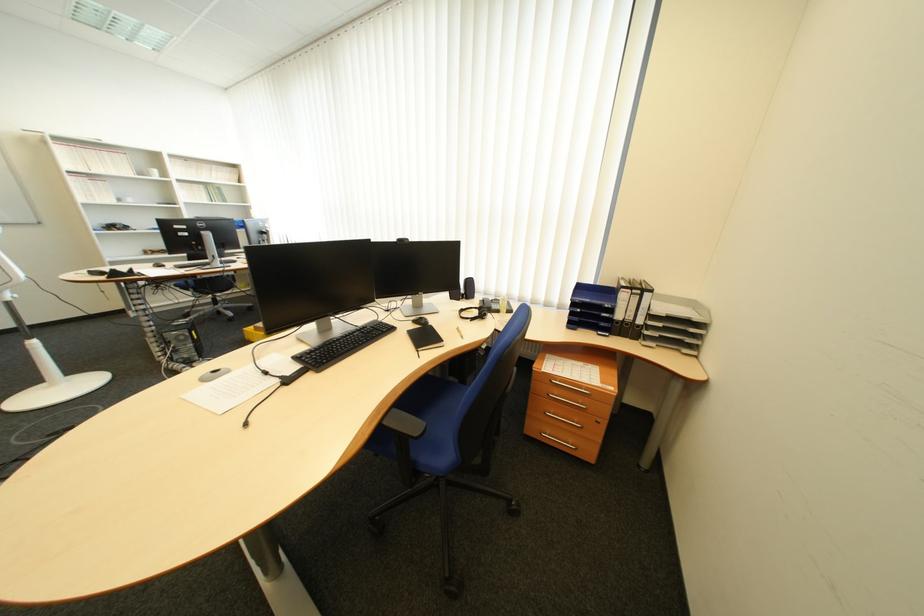
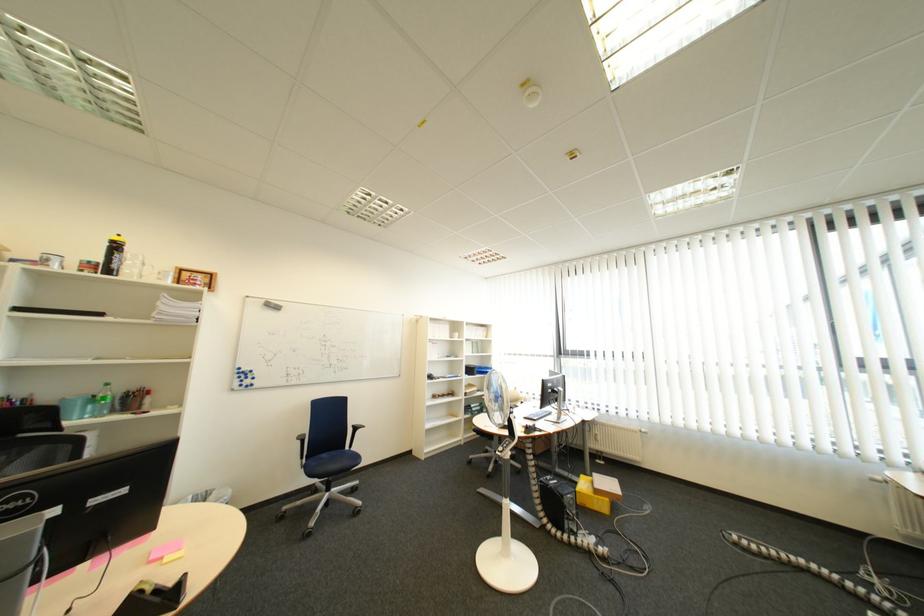
Find the pixel in the second image that matches the point at 195,339 in the first image.

(585, 503)